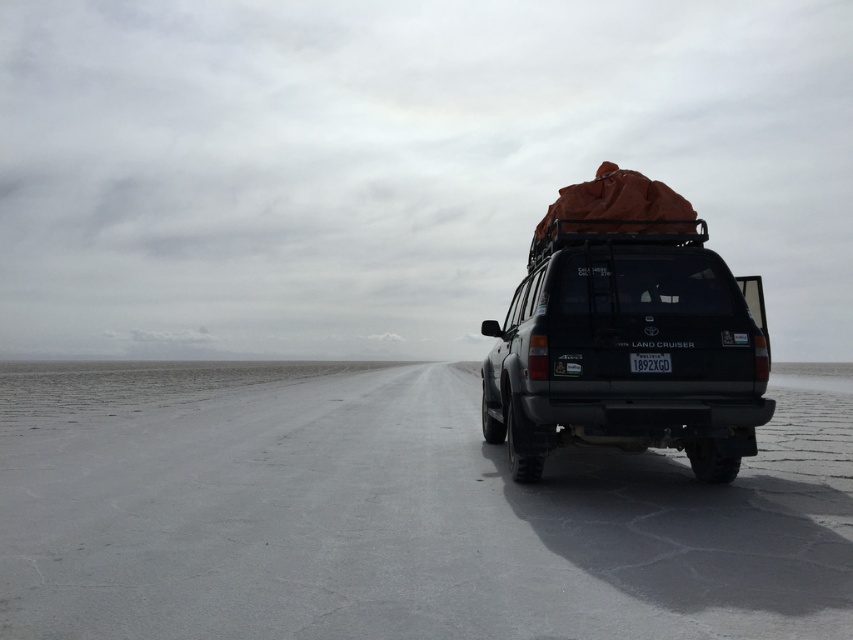
Does matte black suv at center have a smaller size compared to black plastic license plate at center?

Actually, matte black suv at center might be larger than black plastic license plate at center.

Which is above, matte black suv at center or black plastic license plate at center?

black plastic license plate at center

Which is in front, point (613, 340) or point (630, 355)?

Point (630, 355)

Identify the location of matte black suv at center. (628, 353).